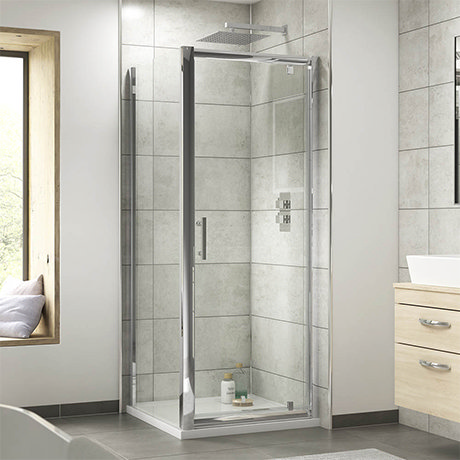
Identify the location of glass. This screenshot has width=460, height=460. (241, 393).